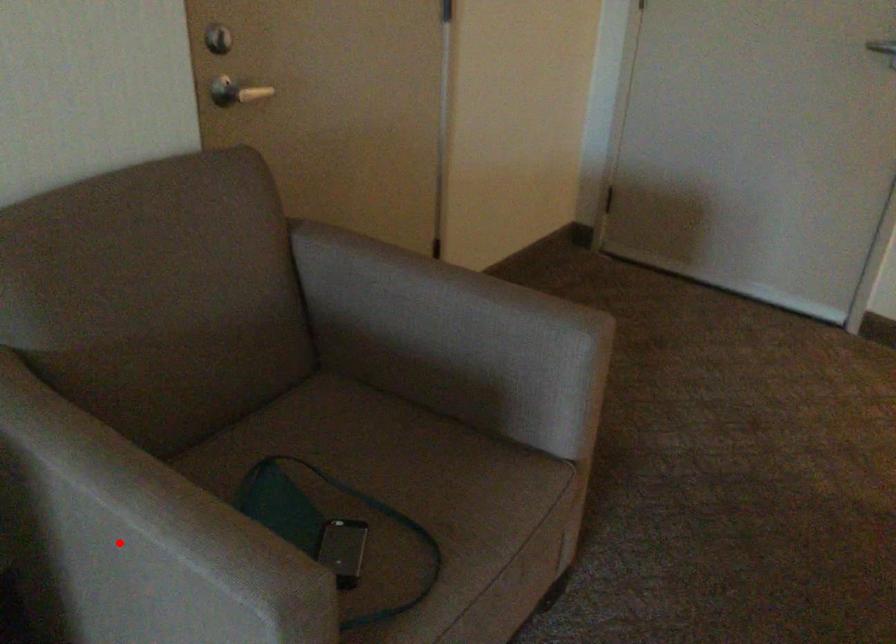
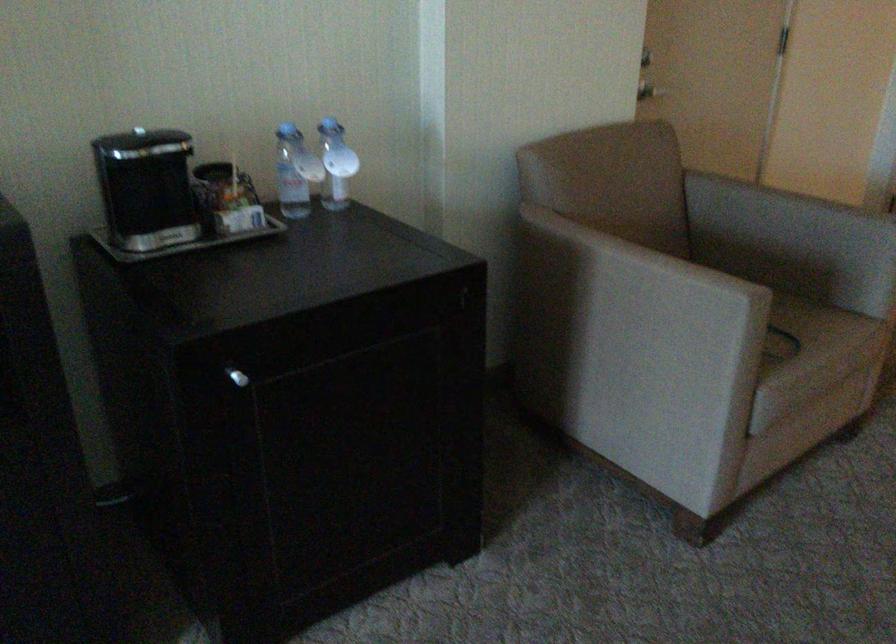
Locate, in the second image, the point that corresponds to the highlighted location in the first image.

(631, 283)